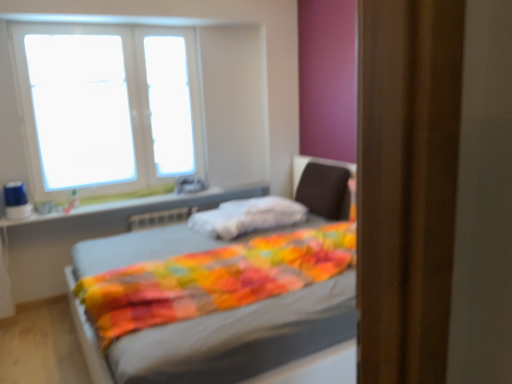
At what (x,y) coordinates should I click in order to perform the action: click on free space above white plastic window at upper left (from a real-world perspective). Please return your answer as a coordinate pair (x, y). Image resolution: width=512 pixels, height=384 pixels. Looking at the image, I should click on (106, 23).